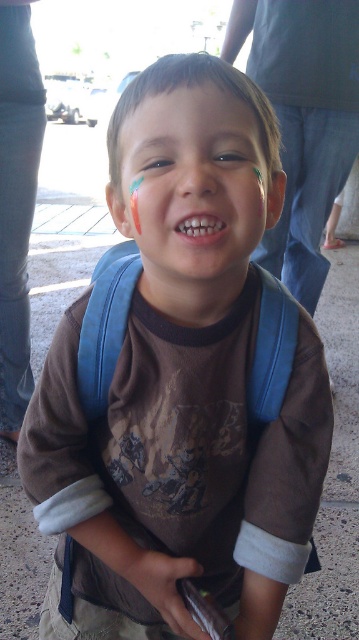
Looking at the boy in the image, which object has a greater width between the matte brown face at center and the brown matte eyebrow at upper center?

The matte brown face at center has a greater width than the brown matte eyebrow at upper center, as stated in the description.

The boy in the image has a smooth skin nose at center and white glossy teeth at center. From the perspective of someone looking at the boy, which object is positioned to the left?

The smooth skin nose at center is positioned to the left of the white glossy teeth at center.